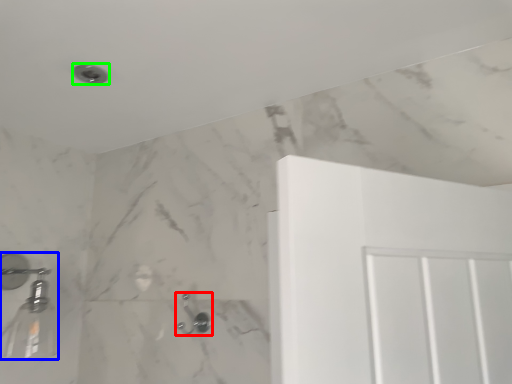
Question: Which object is positioned farthest from shower (highlighted by a red box)? Select from shower (highlighted by a blue box) and shower (highlighted by a green box).

Choices:
 (A) shower
 (B) shower

Answer: (B)